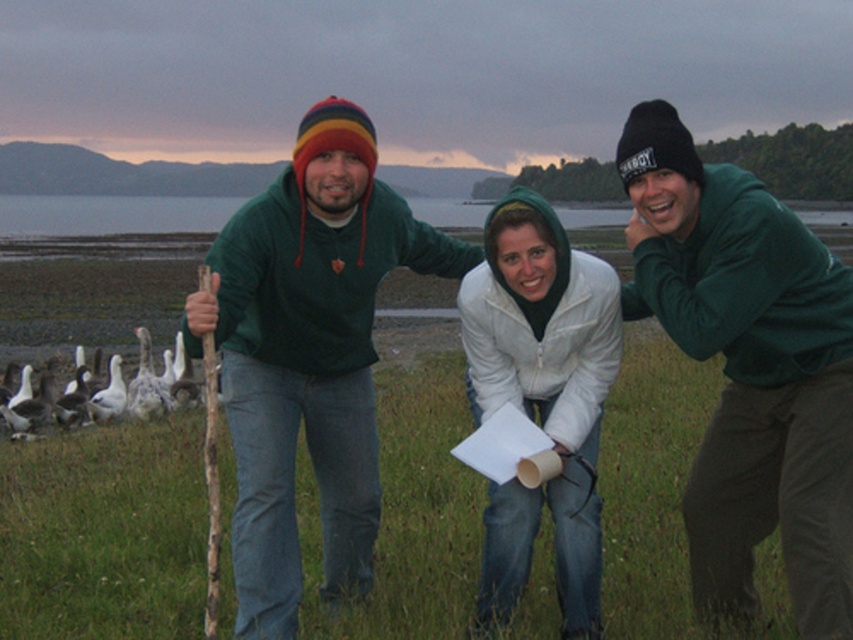
Can you confirm if matte green hoodie at center is taller than green woolen sweater at center?

Yes.

Is matte green hoodie at center behind green woolen sweater at center?

No, matte green hoodie at center is in front of green woolen sweater at center.

Identify the location of matte green hoodie at center. The height and width of the screenshot is (640, 853). (747, 369).

Can you confirm if green woolen sweater at center is bigger than white down feathers at lower left?

No.

Locate an element on the screen. The width and height of the screenshot is (853, 640). green woolen sweater at center is located at coordinates (308, 356).

You are a GUI agent. You are given a task and a screenshot of the screen. Output one action in this format:
    pyautogui.click(x=<x>, y=<y>)
    Task: Click on the green woolen sweater at center
    The image size is (853, 640).
    Given the screenshot: What is the action you would take?
    pyautogui.click(x=308, y=356)

Looking at this image, who is positioned more to the right, green woolen sweater at center or white fleece jacket at center?

Positioned to the right is white fleece jacket at center.

Is green woolen sweater at center positioned at the back of white fleece jacket at center?

No, it is not.

Who is more distant from viewer, (337, 106) or (515, 573)?

The point (515, 573) is more distant.

Identify the location of green woolen sweater at center. The width and height of the screenshot is (853, 640). (308, 356).